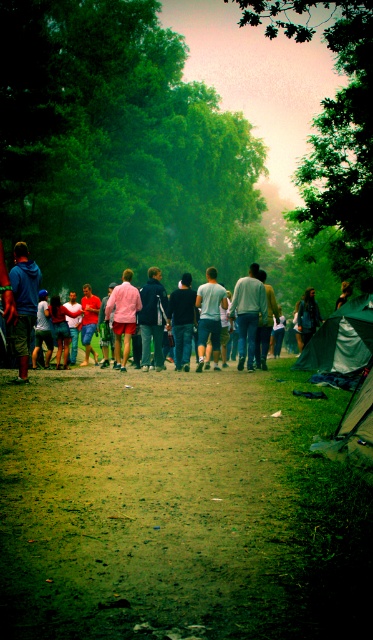
You are standing on the dirt path and see the denim shorts at center and the dark brown leather jacket at center. Which object is closer to the ground?

The denim shorts at center is located below dark brown leather jacket at center, so it is closer to the ground.

You are standing at the starting point of the dirt path and see two points marked on the path ahead. The first point is at coordinate point(367, 304) and the second is at point(320, 316). Which point is closer to you along the path?

Point(367, 304) is in front of point(320, 316), so it is closer to you along the path.